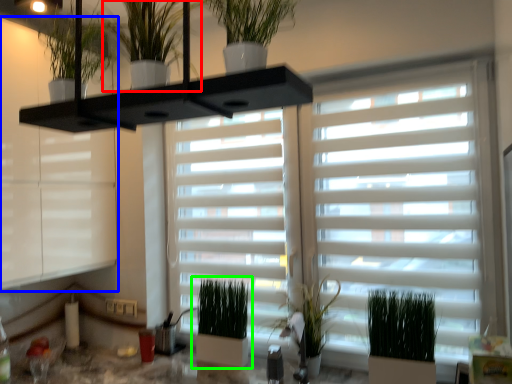
Question: Considering the real-world distances, which object is farthest from houseplant (highlighted by a red box)? window frame (highlighted by a blue box) or houseplant (highlighted by a green box)?

Choices:
 (A) window frame
 (B) houseplant

Answer: (B)